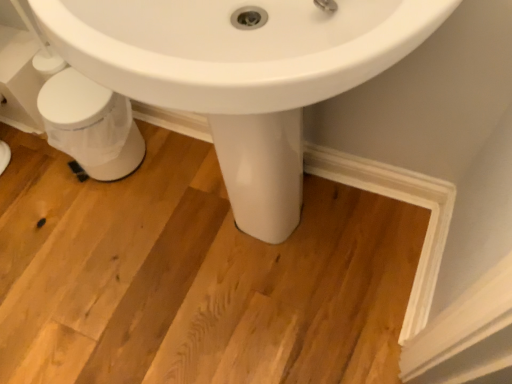
The height and width of the screenshot is (384, 512). In order to click on free region under white glossy sink at center (from a real-world perspective) in this screenshot , I will do `click(256, 243)`.